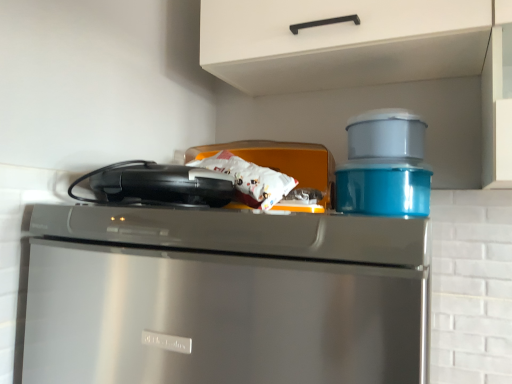
Question: From the image's perspective, would you say glossy plastic container at upper right, the first appliance when ordered from right to left, is positioned over orange plastic container at center, placed as the 3th appliance when sorted from right to left?

Choices:
 (A) yes
 (B) no

Answer: (B)

Question: Is glossy plastic container at upper right, the third appliance from the left, facing away from orange plastic container at center, the first appliance when ordered from left to right?

Choices:
 (A) no
 (B) yes

Answer: (A)

Question: Can you confirm if glossy plastic container at upper right, the first appliance when ordered from right to left, is thinner than orange plastic container at center, placed as the 3th appliance when sorted from right to left?

Choices:
 (A) no
 (B) yes

Answer: (A)

Question: Is glossy plastic container at upper right, the first appliance when ordered from right to left, to the right of orange plastic container at center, placed as the 3th appliance when sorted from right to left, from the viewer's perspective?

Choices:
 (A) no
 (B) yes

Answer: (B)

Question: Considering the relative sizes of glossy plastic container at upper right, the first appliance when ordered from right to left, and orange plastic container at center, placed as the 3th appliance when sorted from right to left, in the image provided, is glossy plastic container at upper right, the first appliance when ordered from right to left, shorter than orange plastic container at center, placed as the 3th appliance when sorted from right to left,?

Choices:
 (A) no
 (B) yes

Answer: (B)

Question: Is glossy plastic container at upper right, the third appliance from the left, next to orange plastic container at center, the first appliance when ordered from left to right, and touching it?

Choices:
 (A) yes
 (B) no

Answer: (B)

Question: Does white matte cabinet handle at upper center lie in front of glossy plastic container at upper right, the third appliance from the left?

Choices:
 (A) no
 (B) yes

Answer: (B)

Question: Is white matte cabinet handle at upper center oriented towards glossy plastic container at upper right, the first appliance when ordered from right to left?

Choices:
 (A) yes
 (B) no

Answer: (B)

Question: From the image's perspective, is white matte cabinet handle at upper center over glossy plastic container at upper right, the first appliance when ordered from right to left?

Choices:
 (A) no
 (B) yes

Answer: (B)

Question: Is there a large distance between white matte cabinet handle at upper center and glossy plastic container at upper right, the first appliance when ordered from right to left?

Choices:
 (A) no
 (B) yes

Answer: (A)

Question: Can you confirm if white matte cabinet handle at upper center is taller than glossy plastic container at upper right, the first appliance when ordered from right to left?

Choices:
 (A) yes
 (B) no

Answer: (A)

Question: Are white matte cabinet handle at upper center and glossy plastic container at upper right, the third appliance from the left, beside each other?

Choices:
 (A) no
 (B) yes

Answer: (A)

Question: Is matte plastic container at upper right, the second appliance from the right, not within stainless steel dishwasher at upper center?

Choices:
 (A) no
 (B) yes

Answer: (B)